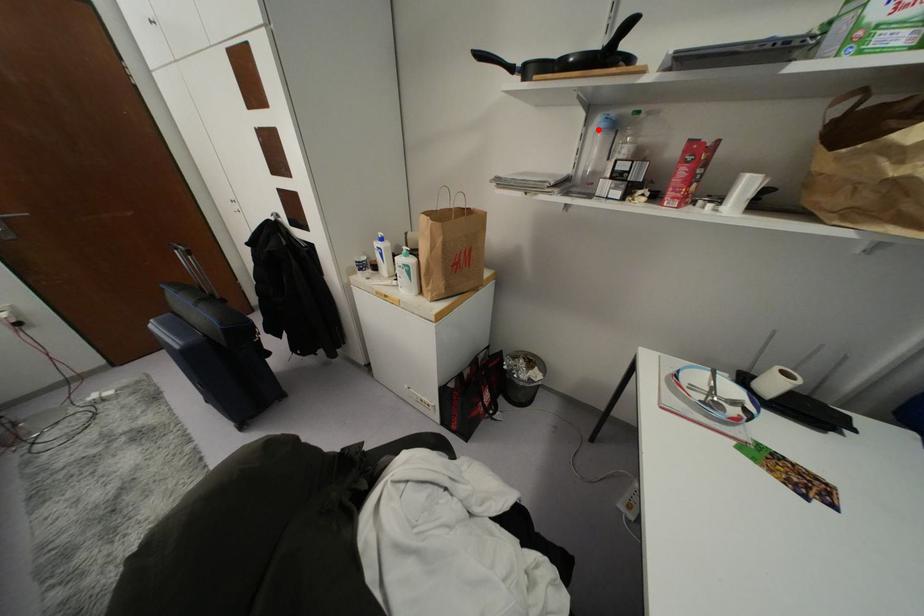
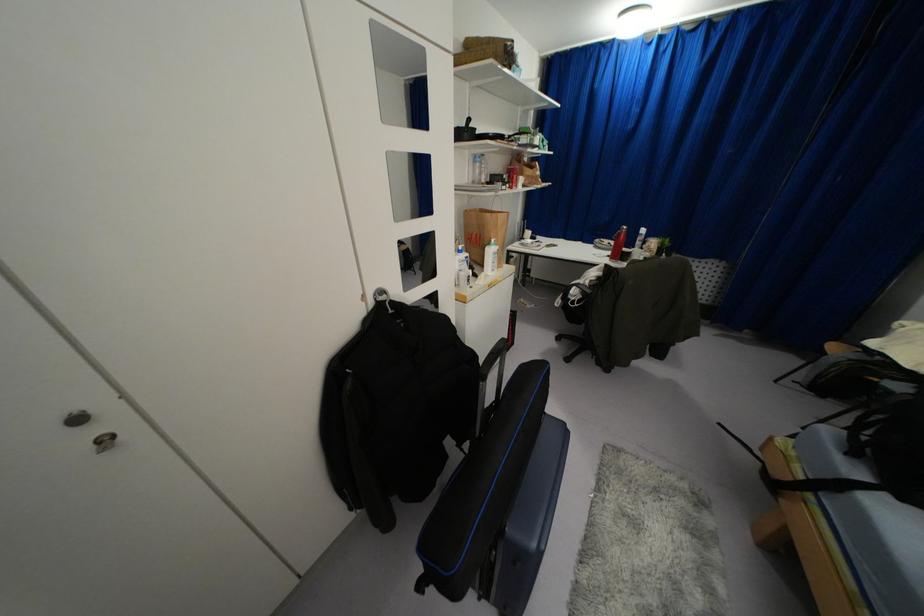
Where in the second image is the point corresponding to the highlighted location from the first image?

(475, 161)